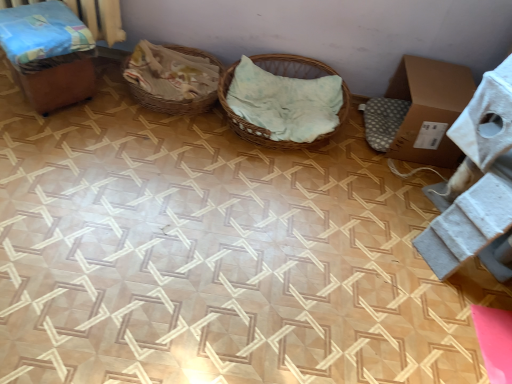
Locate an element on the screen. This screenshot has width=512, height=384. vacant area in front of brown cardboard box at right is located at coordinates (391, 183).